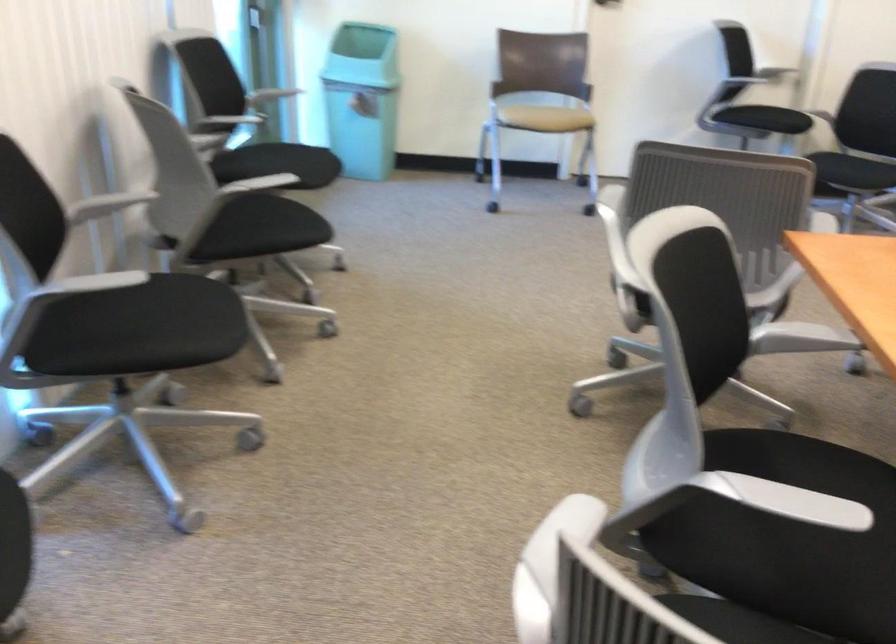
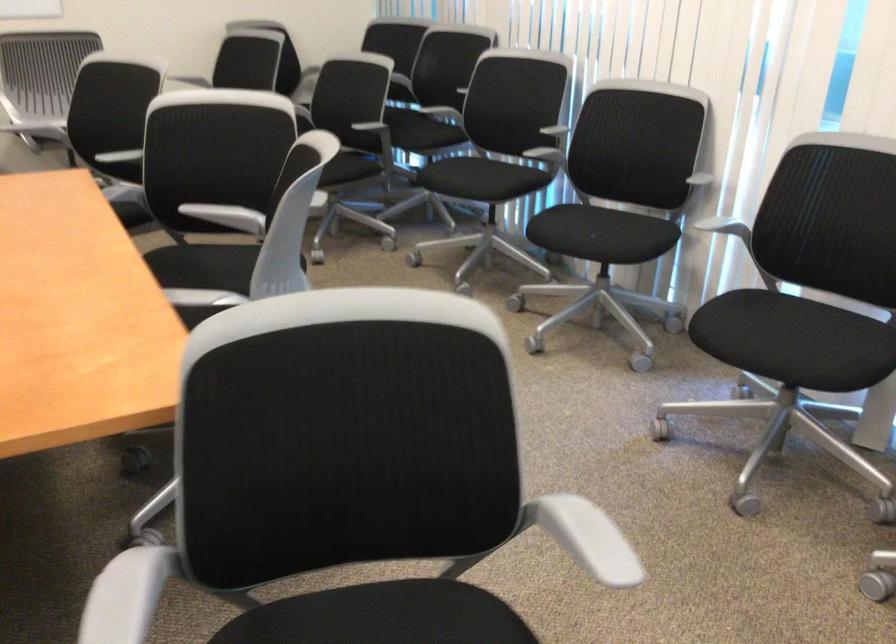
Find the pixel in the second image that matches (170,298) in the first image.

(795, 342)